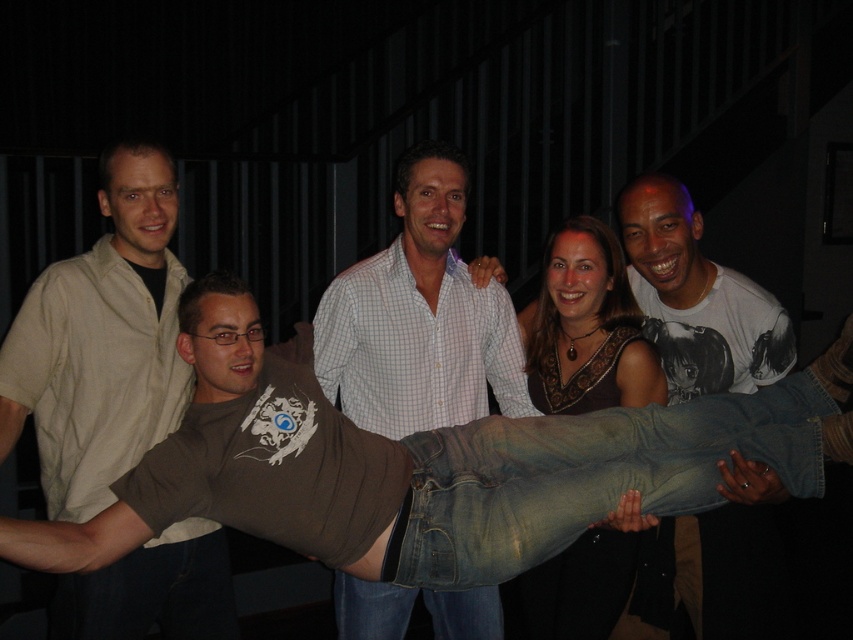
Is point (840, 417) closer to camera compared to point (465, 173)?

Yes, it is.

Is point (780, 390) behind point (445, 246)?

No, it is in front of (445, 246).

The height and width of the screenshot is (640, 853). Identify the location of jeans at center. (425, 465).

Between point (128, 417) and point (392, 602), which one is positioned behind?

The point (392, 602) is behind.

Which is above, light beige shirt at left or white checkered shirt at center?

white checkered shirt at center

The height and width of the screenshot is (640, 853). What do you see at coordinates (102, 342) in the screenshot?
I see `light beige shirt at left` at bounding box center [102, 342].

This screenshot has height=640, width=853. What are the coordinates of `light beige shirt at left` in the screenshot? It's located at (102, 342).

Does point (849, 413) lie behind point (97, 381)?

No, it is not.

Is point (218, 433) less distant than point (138, 184)?

Yes, it is.

Where is `jeans at center`? Image resolution: width=853 pixels, height=640 pixels. jeans at center is located at coordinates (425, 465).